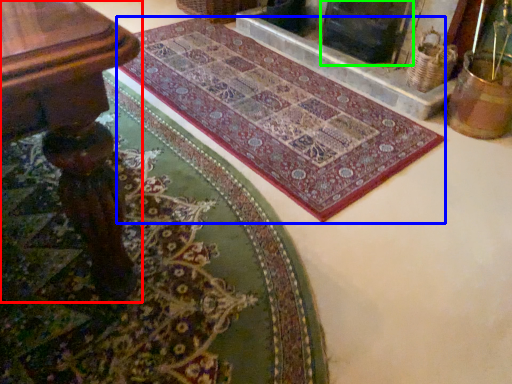
Question: Estimate the real-world distances between objects in this image. Which object is farther from table (highlighted by a red box), mat (highlighted by a blue box) or fireplace (highlighted by a green box)?

Choices:
 (A) mat
 (B) fireplace

Answer: (B)